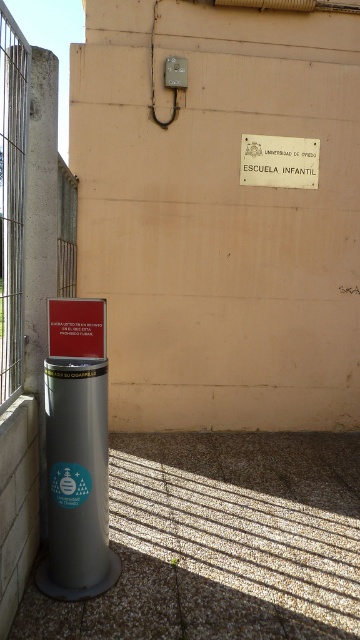
You are standing in front of the beige wall with the kindergarten sign. There is a point marked at coordinates (11, 198) on the wall. What object is located at that point?

The point at coordinates (11, 198) marks the location of the concrete fence at left.

You are a painter who needs to know which object is taller between the concrete fence at left and the white matte sign at upper center. Can you determine which one is taller?

The concrete fence at left has a greater height compared to the white matte sign at upper center, so the concrete fence at left is taller.